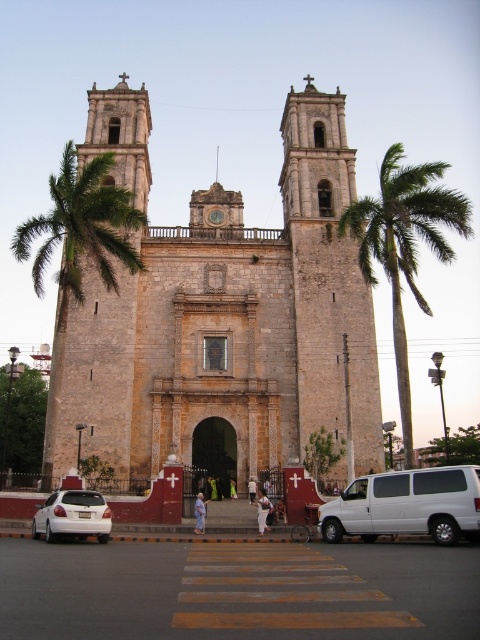
Question: Can you confirm if green leafy palm tree at left is positioned to the right of green leafy palm tree at center?

Choices:
 (A) no
 (B) yes

Answer: (A)

Question: Which point is farther to the camera?

Choices:
 (A) stone church at center
 (B) stone bell tower at center
 (C) green leafy palm tree at center

Answer: (A)

Question: Among these objects, which one is nearest to the camera?

Choices:
 (A) green leafy palm tree at left
 (B) stone bell tower at center

Answer: (B)

Question: Does stone church at center appear on the right side of green leafy palm tree at center?

Choices:
 (A) yes
 (B) no

Answer: (B)

Question: Can you confirm if stone church at center is positioned below green leafy palm tree at left?

Choices:
 (A) yes
 (B) no

Answer: (B)

Question: Which point is farther to the camera?

Choices:
 (A) (206, 461)
 (B) (39, 508)
 (C) (377, 410)
 (D) (392, 502)

Answer: (C)